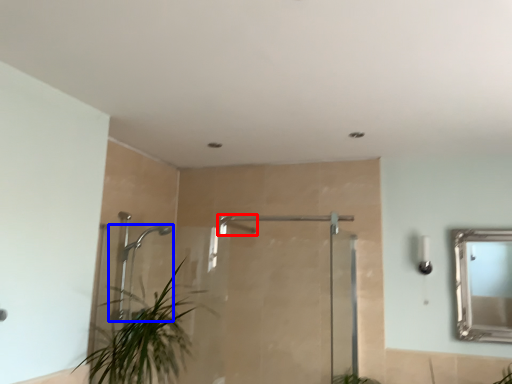
Question: Among these objects, which one is farthest to the camera, shower (highlighted by a red box) or shower (highlighted by a blue box)?

Choices:
 (A) shower
 (B) shower

Answer: (B)